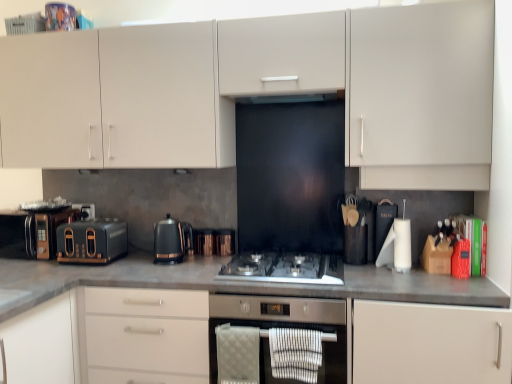
Question: Is matte black toaster at left, placed as the second kitchen appliance when sorted from right to left, oriented away from stainless steel gas stove at center?

Choices:
 (A) no
 (B) yes

Answer: (A)

Question: From the image's perspective, is matte black toaster at left, placed as the second kitchen appliance when sorted from right to left, below stainless steel gas stove at center?

Choices:
 (A) no
 (B) yes

Answer: (A)

Question: Is matte black toaster at left, placed as the second kitchen appliance when sorted from right to left, positioned beyond the bounds of stainless steel gas stove at center?

Choices:
 (A) no
 (B) yes

Answer: (B)

Question: Can you confirm if matte black toaster at left, placed as the second kitchen appliance when sorted from right to left, is shorter than stainless steel gas stove at center?

Choices:
 (A) yes
 (B) no

Answer: (B)

Question: From the image's perspective, is matte black toaster at left, positioned as the first kitchen appliance in left-to-right order, over stainless steel gas stove at center?

Choices:
 (A) yes
 (B) no

Answer: (A)

Question: Can you confirm if matte black toaster at left, positioned as the first kitchen appliance in left-to-right order, is positioned to the left of stainless steel gas stove at center?

Choices:
 (A) no
 (B) yes

Answer: (B)

Question: From the image's perspective, would you say matte white cabinet at center, which is the 2th cabinetry in top-to-bottom order, is shown under black metallic kettle at center, which ranks as the 2th kitchen appliance in left-to-right order?

Choices:
 (A) no
 (B) yes

Answer: (B)

Question: Is matte white cabinet at center, which is the 2th cabinetry in top-to-bottom order, facing away from black metallic kettle at center, which appears as the 1th kitchen appliance when viewed from the right?

Choices:
 (A) no
 (B) yes

Answer: (A)

Question: Considering the relative sizes of matte white cabinet at center, which is the 2th cabinetry in top-to-bottom order, and black metallic kettle at center, which ranks as the 2th kitchen appliance in left-to-right order, in the image provided, is matte white cabinet at center, which is the 2th cabinetry in top-to-bottom order, wider than black metallic kettle at center, which ranks as the 2th kitchen appliance in left-to-right order,?

Choices:
 (A) yes
 (B) no

Answer: (A)

Question: Does matte white cabinet at center, which is the first cabinetry from bottom to top, appear on the right side of black metallic kettle at center, which appears as the 1th kitchen appliance when viewed from the right?

Choices:
 (A) no
 (B) yes

Answer: (B)

Question: Is matte white cabinet at center, which is the first cabinetry from bottom to top, positioned before black metallic kettle at center, which ranks as the 2th kitchen appliance in left-to-right order?

Choices:
 (A) yes
 (B) no

Answer: (A)

Question: Is matte white cabinet at center, which is the 2th cabinetry in top-to-bottom order, placed right next to black metallic kettle at center, which ranks as the 2th kitchen appliance in left-to-right order?

Choices:
 (A) yes
 (B) no

Answer: (B)

Question: From a real-world perspective, is matte white cabinet at center, which is the 2th cabinetry in top-to-bottom order, located beneath metallic copper kettle at center, the first appliance viewed from the right?

Choices:
 (A) yes
 (B) no

Answer: (A)